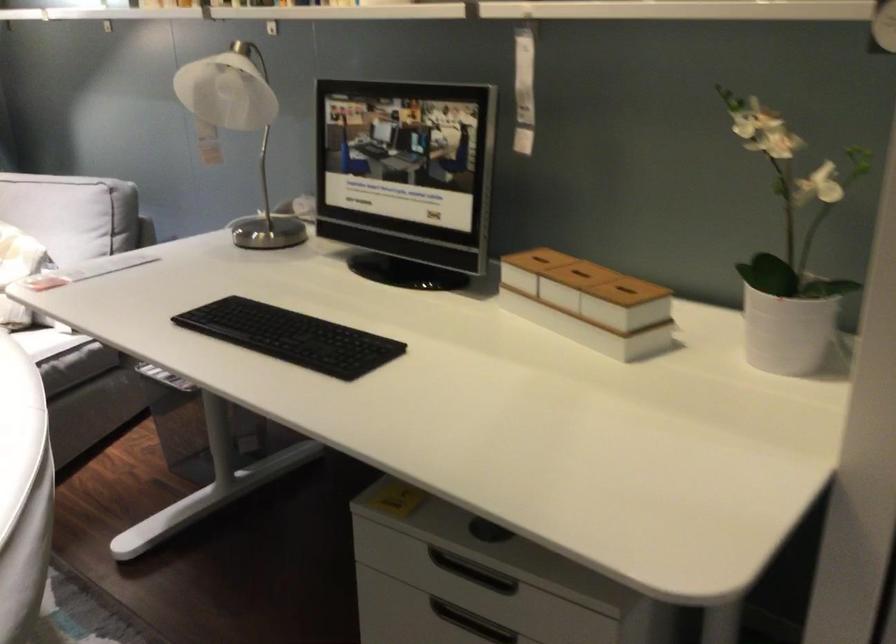
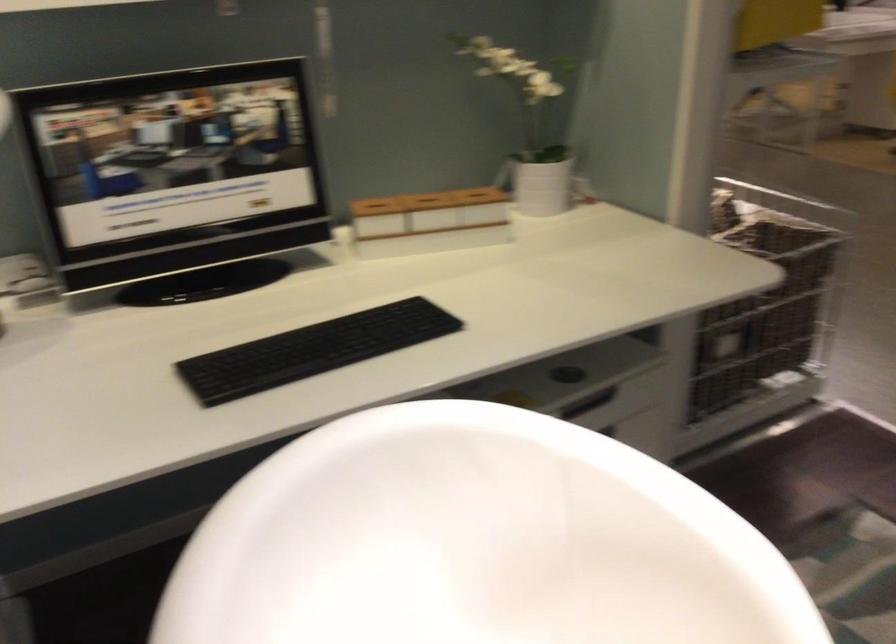
In the second image, find the point that corresponds to (270,325) in the first image.

(313, 350)